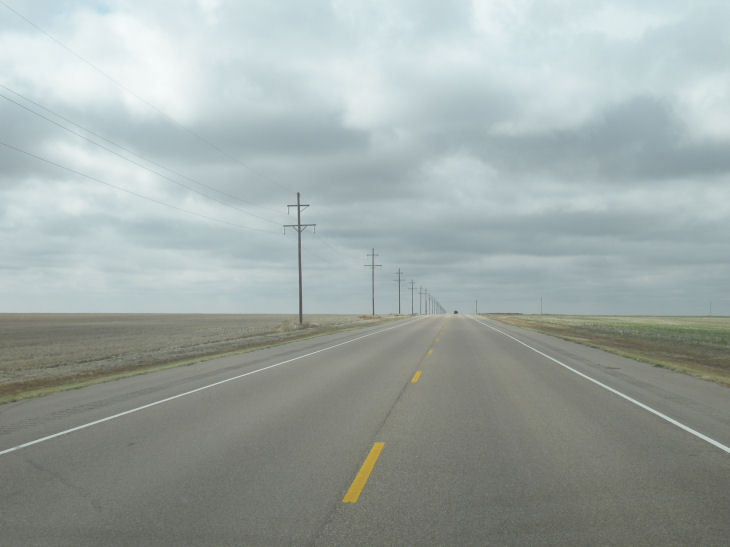
You are a GUI agent. You are given a task and a screenshot of the screen. Output one action in this format:
    pyautogui.click(x=<x>, y=<y>)
    Task: Click on the cords
    The image size is (730, 547).
    Given the screenshot: What is the action you would take?
    pyautogui.click(x=268, y=179)